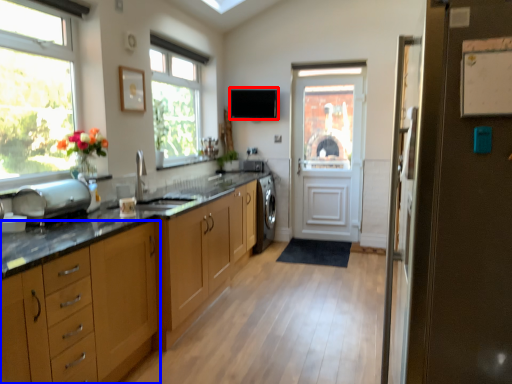
Question: Which of the following is the farthest to the observer, exhaust hood (highlighted by a red box) or cabinetry (highlighted by a blue box)?

Choices:
 (A) exhaust hood
 (B) cabinetry

Answer: (A)